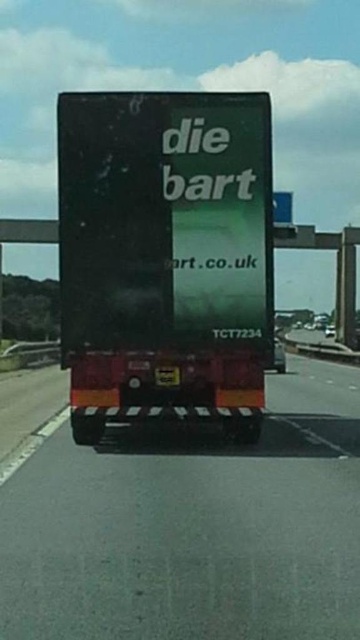
You are a photographer standing on the side of the road. You want to take a photo of the black rubber truck at center and the matte black truck at center. Which one is positioned to the right side of the other?

The black rubber truck at center is positioned to the right of the matte black truck at center.

You are a photographer trying to capture the truck in the image. You notice two parts of the truck labeled as the black rubber truck at center and the matte black truck at center. Which part of the truck is shorter in height?

The black rubber truck at center has a lesser height compared to the matte black truck at center, so the black rubber truck at center is shorter.